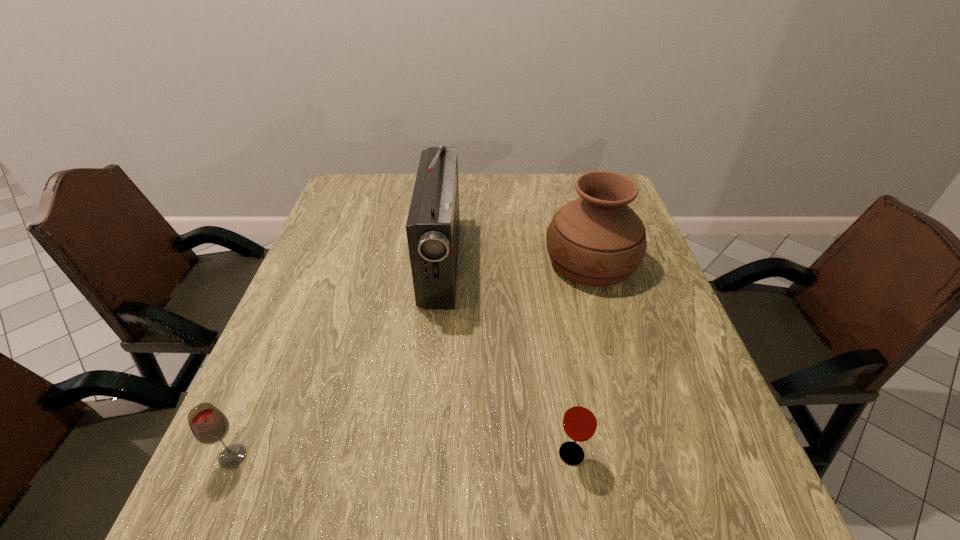
Image resolution: width=960 pixels, height=540 pixels. In order to click on object that is at the right edge in this screenshot , I will do `click(598, 240)`.

This screenshot has width=960, height=540. I want to click on free spot at the far edge of the desktop, so click(x=516, y=179).

Find the location of a particular element. vacant area at the near edge of the desktop is located at coordinates (432, 518).

Find the location of a particular element. free space at the left edge is located at coordinates (331, 289).

I want to click on blank area at the right edge, so click(x=620, y=353).

I want to click on vacant area at the far left corner of the desktop, so click(x=356, y=190).

I want to click on vacant area that lies between the leftmost object and the right glass drink container, so click(x=402, y=455).

The width and height of the screenshot is (960, 540). What are the coordinates of `vacant area that lies between the right glass drink container and the leftmost object` in the screenshot? It's located at point(402,455).

The image size is (960, 540). Identify the location of vacant area that lies between the right glass drink container and the second tallest object. (581, 358).

Where is `free space between the urn and the tallest object`? The width and height of the screenshot is (960, 540). free space between the urn and the tallest object is located at coordinates (516, 262).